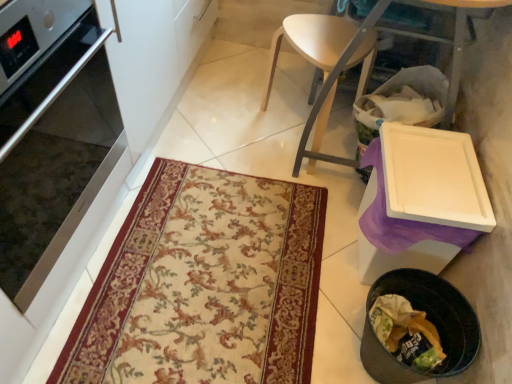
Where is `free area in between light wood chair at center and beige floral rug at center`? free area in between light wood chair at center and beige floral rug at center is located at coordinates click(268, 161).